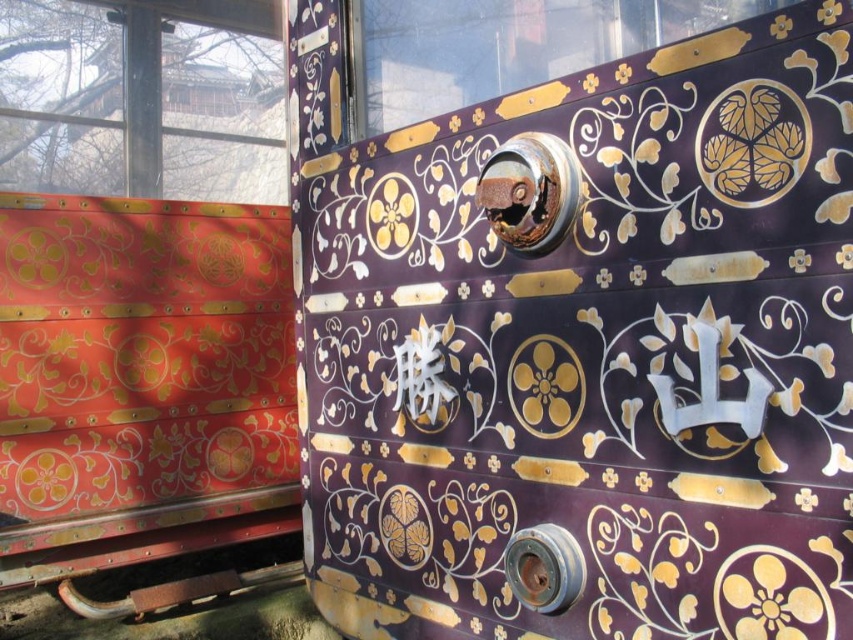
Question: Which object appears closest to the camera in this image?

Choices:
 (A) transparent glass window at upper left
 (B) glossy glass window at upper center
 (C) purple lacquered door at center

Answer: (C)

Question: Does transparent glass window at upper left appear on the right side of glossy glass window at upper center?

Choices:
 (A) no
 (B) yes

Answer: (A)

Question: Among these points, which one is farthest from the camera?

Choices:
 (A) (825, 413)
 (B) (6, 157)

Answer: (B)

Question: Is transparent glass window at upper left in front of glossy glass window at upper center?

Choices:
 (A) no
 (B) yes

Answer: (A)

Question: Considering the relative positions of purple lacquered door at center and transparent glass window at upper left in the image provided, where is purple lacquered door at center located with respect to transparent glass window at upper left?

Choices:
 (A) below
 (B) above

Answer: (A)

Question: Which point appears farthest from the camera in this image?

Choices:
 (A) (463, 68)
 (B) (148, 168)

Answer: (B)